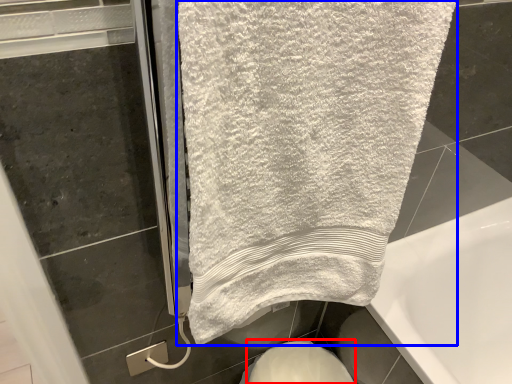
Question: Among these objects, which one is farthest to the camera, bidet (highlighted by a red box) or towel (highlighted by a blue box)?

Choices:
 (A) bidet
 (B) towel

Answer: (A)